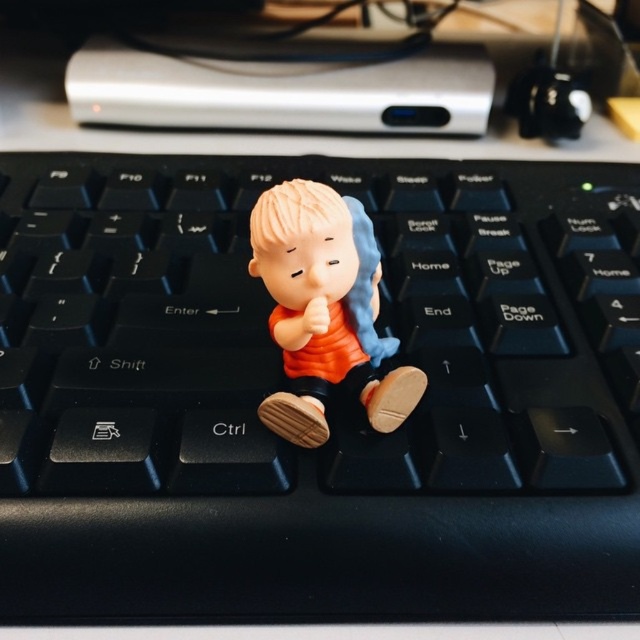
Does black plastic keyboard at center appear over matte orange figurine at center?

Yes.

Does point (609, 205) lie behind point (305, 420)?

Yes, point (609, 205) is behind point (305, 420).

Image resolution: width=640 pixels, height=640 pixels. Identify the location of black plastic keyboard at center. (278, 349).